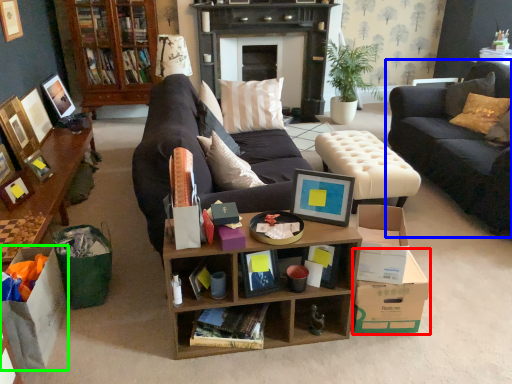
Question: Which object is positioned closest to cardboard box (highlighted by a red box)? Select from studio couch (highlighted by a blue box) and cardboard box (highlighted by a green box).

Choices:
 (A) studio couch
 (B) cardboard box

Answer: (A)